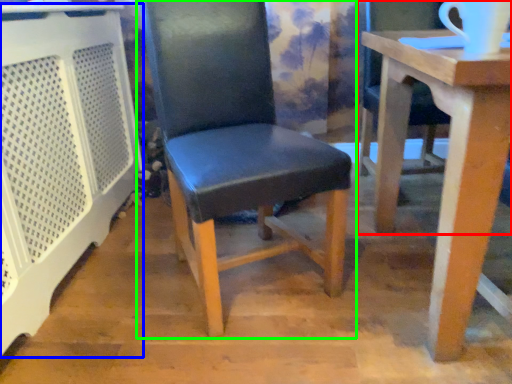
Question: Estimate the real-world distances between objects in this image. Which object is farther from chair (highlighted by a red box), cage (highlighted by a blue box) or chair (highlighted by a green box)?

Choices:
 (A) cage
 (B) chair

Answer: (A)